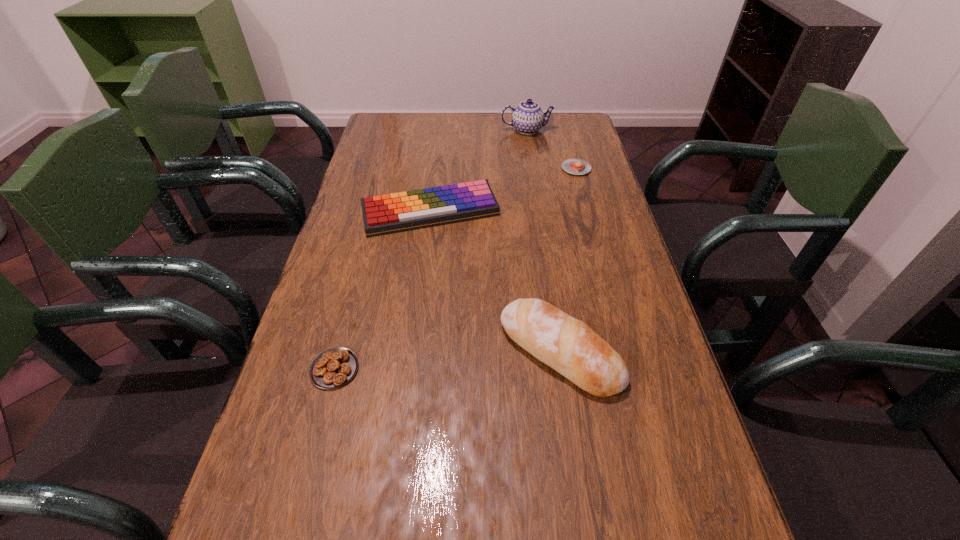
I want to click on vacant space located 0.280m on the front of the third tallest object, so click(x=417, y=320).

Find the location of a particular element. free point located on the left of the farther pastry is located at coordinates (483, 168).

Identify the location of vacant area situated 0.090m on the back of the left pastry. This screenshot has width=960, height=540. (348, 315).

You are a GUI agent. You are given a task and a screenshot of the screen. Output one action in this format:
    pyautogui.click(x=<x>, y=<y>)
    Task: Click on the object that is at the far edge
    
    Given the screenshot: What is the action you would take?
    pyautogui.click(x=528, y=117)

You are a GUI agent. You are given a task and a screenshot of the screen. Output one action in this format:
    pyautogui.click(x=<x>, y=<y>)
    Task: Click on the computer keyboard present at the left edge
    
    Given the screenshot: What is the action you would take?
    pyautogui.click(x=384, y=214)

Identify the location of pastry that is at the left edge. Image resolution: width=960 pixels, height=540 pixels. (332, 368).

At what (x,y) coordinates should I click in order to perform the action: click on chinaware that is at the right edge. Please return your answer as a coordinate pair (x, y). This screenshot has height=540, width=960. Looking at the image, I should click on (528, 117).

The image size is (960, 540). Find the location of `bread situated at the right edge`. bread situated at the right edge is located at coordinates (569, 346).

This screenshot has width=960, height=540. I want to click on pastry that is positioned at the right edge, so click(573, 166).

I want to click on object at the far right corner, so click(x=528, y=117).